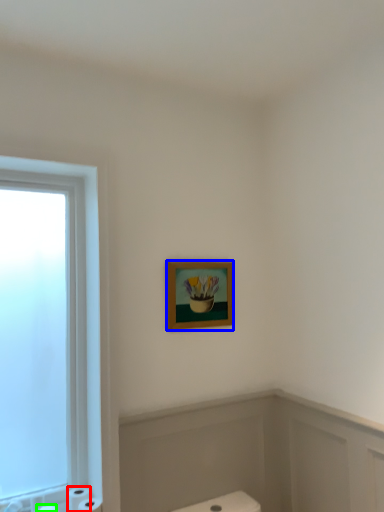
Question: Which object is the farthest from toilet paper (highlighted by a red box)? Choose among these: picture frame (highlighted by a blue box) or toilet paper (highlighted by a green box).

Choices:
 (A) picture frame
 (B) toilet paper

Answer: (A)